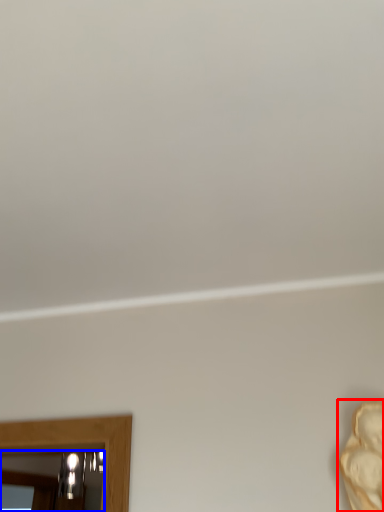
Question: Which object is closer to the camera taking this photo, person (highlighted by a red box) or mirror (highlighted by a blue box)?

Choices:
 (A) person
 (B) mirror

Answer: (A)